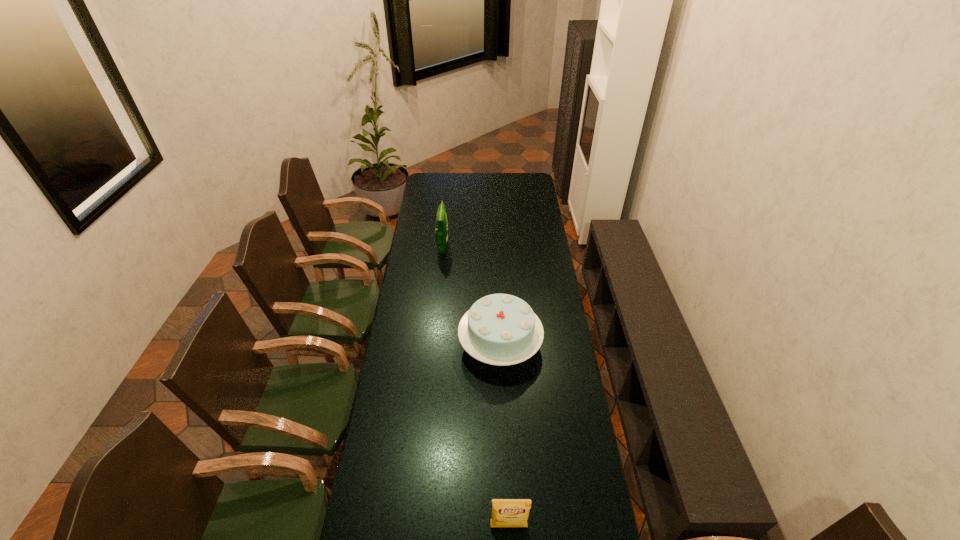
Identify the location of the farther crisp (potato chip). This screenshot has width=960, height=540. (441, 228).

The height and width of the screenshot is (540, 960). What are the coordinates of `the taller crisp (potato chip)` in the screenshot? It's located at (441, 228).

You are a GUI agent. You are given a task and a screenshot of the screen. Output one action in this format:
    pyautogui.click(x=<x>, y=<y>)
    Task: Click on the birthday cake
    This screenshot has height=540, width=960.
    Given the screenshot: What is the action you would take?
    pyautogui.click(x=499, y=329)

This screenshot has height=540, width=960. In order to click on the shorter crisp (potato chip) in this screenshot , I will do `click(506, 512)`.

Where is `the right crisp (potato chip)`? the right crisp (potato chip) is located at coordinates (506, 512).

Find the location of `free spot located 0.290m on the front-facing side of the farther crisp (potato chip)`. free spot located 0.290m on the front-facing side of the farther crisp (potato chip) is located at coordinates (504, 247).

You are a GUI agent. You are given a task and a screenshot of the screen. Output one action in this format:
    pyautogui.click(x=<x>, y=<y>)
    Task: Click on the vacant space located on the back of the birthday cake
    
    Given the screenshot: What is the action you would take?
    pyautogui.click(x=497, y=288)

You are a GUI agent. You are given a task and a screenshot of the screen. Output one action in this format:
    pyautogui.click(x=<x>, y=<y>)
    Task: Click on the object that is at the left edge
    This screenshot has width=960, height=540.
    Given the screenshot: What is the action you would take?
    pyautogui.click(x=441, y=228)

Locate an element on the screen. object located in the right edge section of the desktop is located at coordinates (499, 329).

Locate an element on the screen. The width and height of the screenshot is (960, 540). vacant space at the far edge is located at coordinates (496, 179).